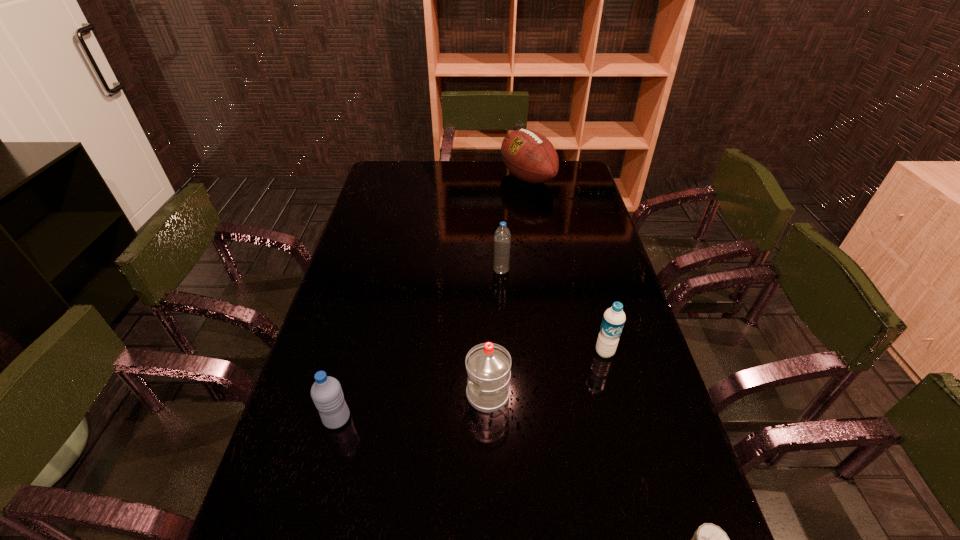
Where is `football (American)`? football (American) is located at coordinates (x=529, y=156).

Image resolution: width=960 pixels, height=540 pixels. In order to click on the farthest water bottle in this screenshot , I will do `click(502, 238)`.

The width and height of the screenshot is (960, 540). Find the location of `the rightmost water bottle`. the rightmost water bottle is located at coordinates (614, 318).

Find the location of a particular element. Image resolution: width=960 pixels, height=540 pixels. the third nearest water bottle is located at coordinates (614, 318).

Locate an element on the screen. the leftmost object is located at coordinates (326, 392).

Identify the location of blank area located on the front of the farthest object. (532, 208).

What are the coordinates of `blank space located on the back of the farthest water bottle` in the screenshot? It's located at (499, 234).

Where is `vacant region located 0.080m on the label of the rightmost water bottle`? vacant region located 0.080m on the label of the rightmost water bottle is located at coordinates (613, 385).

The image size is (960, 540). Find the location of `free region located on the right of the leftmost water bottle`. free region located on the right of the leftmost water bottle is located at coordinates (434, 418).

The height and width of the screenshot is (540, 960). I want to click on object that is at the far edge, so click(x=529, y=156).